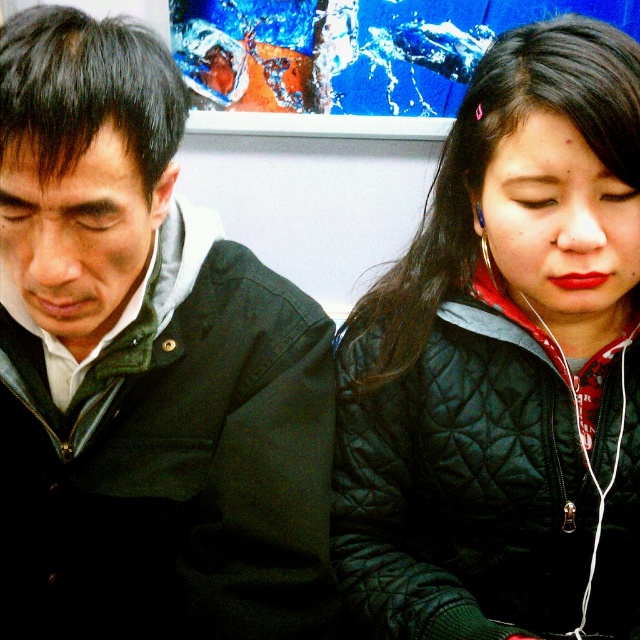
Does matte black jacket at left have a smaller size compared to black quilted jacket at center?

Incorrect, matte black jacket at left is not smaller in size than black quilted jacket at center.

Who is more distant from viewer, (12,624) or (536,426)?

The point (12,624) is more distant.

Identify the location of matte black jacket at left. This screenshot has width=640, height=640. (144, 368).